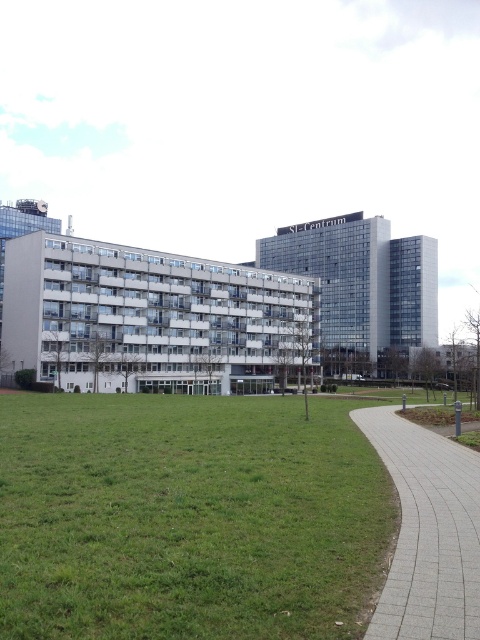
You are planning to install a new bench in the park. The bench requires a space wider than the green grass at lower left. Will the white concrete building at center provide enough space for the bench?

The green grass at lower left is narrower than the white concrete building at center, so the white concrete building at center has sufficient space to accommodate the bench since its width is greater than the grass area.

You are standing at the point marked as point (187, 518) in the image. What is the nearest object to you?

The nearest object to you is the green grass at lower left, as the point (187, 518) indicates its location.